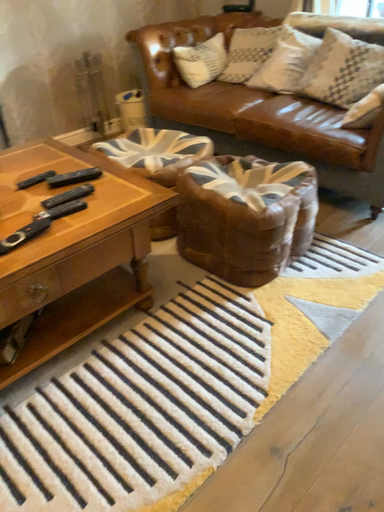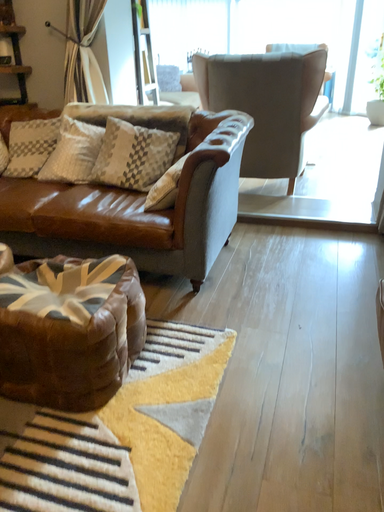
Question: Which way did the camera rotate in the video?

Choices:
 (A) rotated right
 (B) rotated left

Answer: (A)